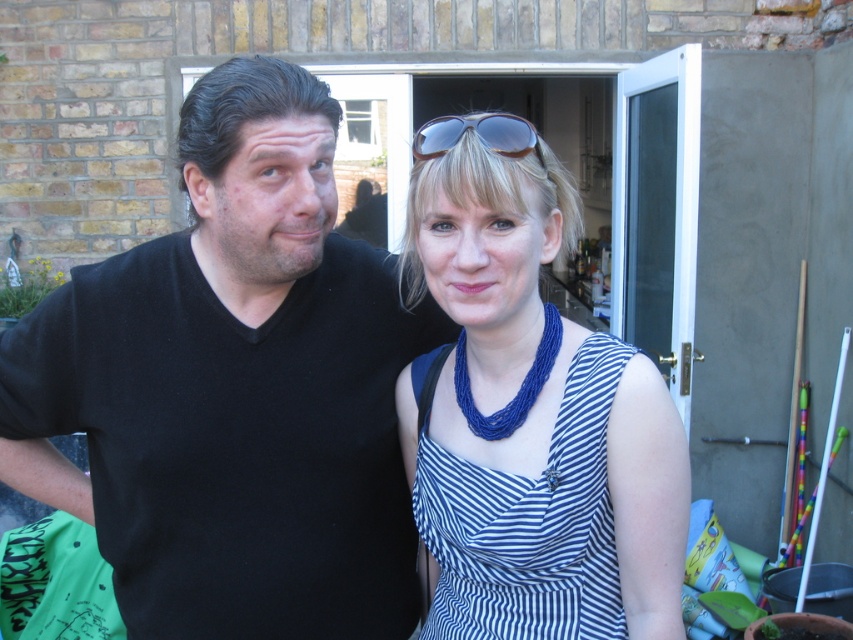
In the scene shown: You are a photographer trying to focus on the black matte shirt at left and the sunglasses at upper center. Which object is closer to the camera?

The sunglasses at upper center is behind the black matte shirt at left, so the black matte shirt at left is closer to the camera.

You are a photographer trying to capture a group photo of the black matte shirt at left and the blue striped dress at center. If you want to ensure both subjects are in focus, which subject should you focus on first to account for their sizes?

The black matte shirt at left is wider than the blue striped dress at center, so focusing on the black matte shirt at left first would ensure both are in focus since it takes up more space in the frame.